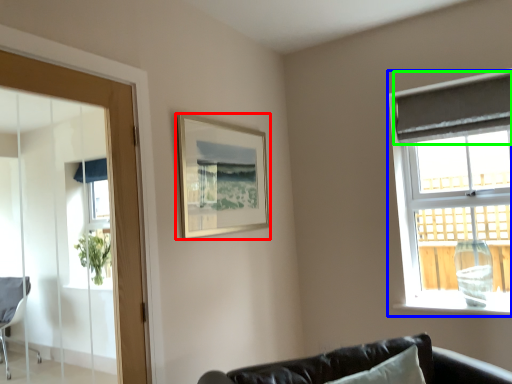
Question: Which is nearer to the picture frame (highlighted by a red box)? window (highlighted by a blue box) or curtain (highlighted by a green box).

Choices:
 (A) window
 (B) curtain

Answer: (A)